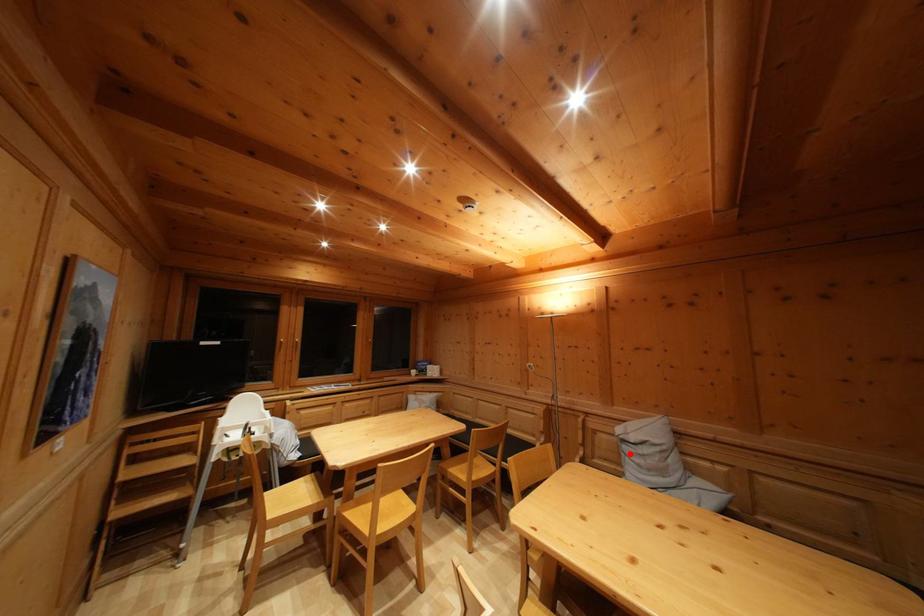
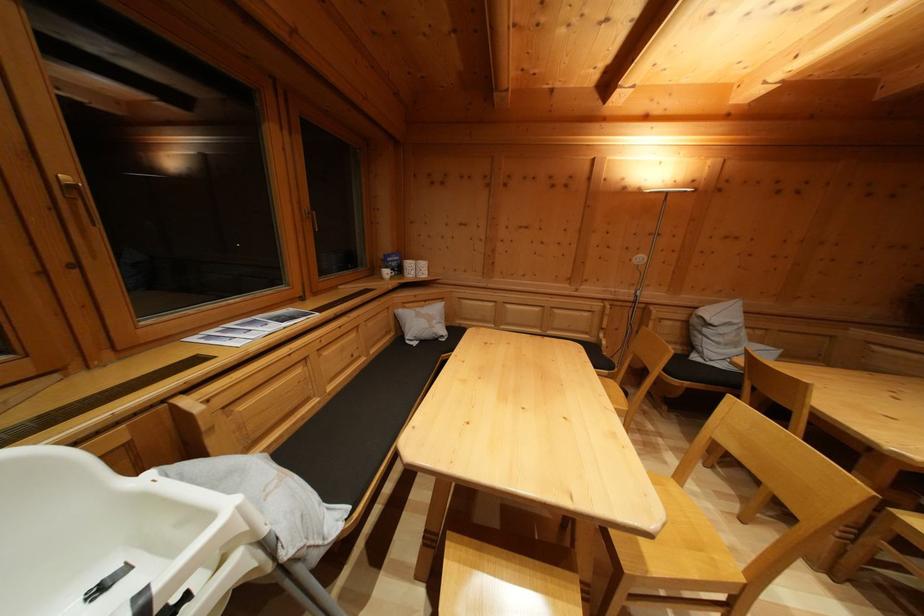
The point at the highlighted location is marked in the first image. Where is the corresponding point in the second image?

(711, 337)